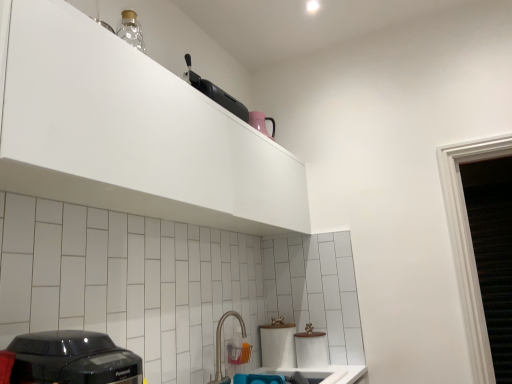
Question: Considering the relative sizes of black plastic toaster at upper center and white glossy sink at lower center in the image provided, is black plastic toaster at upper center smaller than white glossy sink at lower center?

Choices:
 (A) yes
 (B) no

Answer: (A)

Question: Is black plastic toaster at upper center further to the viewer compared to white glossy sink at lower center?

Choices:
 (A) yes
 (B) no

Answer: (A)

Question: Are black plastic toaster at upper center and white glossy sink at lower center located far from each other?

Choices:
 (A) yes
 (B) no

Answer: (A)

Question: Would you say white glossy sink at lower center is part of black plastic toaster at upper center's contents?

Choices:
 (A) no
 (B) yes

Answer: (A)

Question: Is black plastic toaster at upper center in front of white glossy sink at lower center?

Choices:
 (A) no
 (B) yes

Answer: (A)

Question: Is black plastic toaster at upper center oriented towards white glossy sink at lower center?

Choices:
 (A) no
 (B) yes

Answer: (A)

Question: Is black plastic toaster at upper center at the back of white glossy sink at lower center?

Choices:
 (A) no
 (B) yes

Answer: (A)

Question: From a real-world perspective, is white glossy sink at lower center on top of black plastic toaster at upper center?

Choices:
 (A) no
 (B) yes

Answer: (A)

Question: Is white glossy sink at lower center not close to black plastic toaster at upper center?

Choices:
 (A) yes
 (B) no

Answer: (A)

Question: Is white glossy sink at lower center behind black plastic toaster at upper center?

Choices:
 (A) no
 (B) yes

Answer: (A)

Question: Is the depth of white glossy sink at lower center less than that of black plastic toaster at upper center?

Choices:
 (A) yes
 (B) no

Answer: (A)

Question: From a real-world perspective, is white glossy sink at lower center located beneath black plastic toaster at upper center?

Choices:
 (A) no
 (B) yes

Answer: (B)

Question: From a real-world perspective, is white glossy sink at lower center below white matte cabinet at upper center?

Choices:
 (A) no
 (B) yes

Answer: (B)